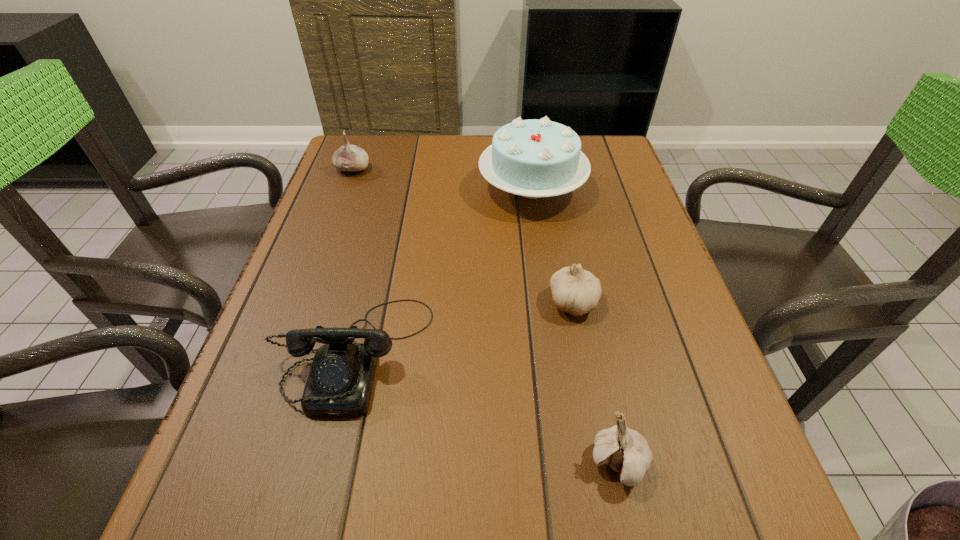
I want to click on birthday cake, so click(x=534, y=158).

At what (x,y) coordinates should I click in order to perform the action: click on the leftmost garlic. Please return your answer as a coordinate pair (x, y). The height and width of the screenshot is (540, 960). Looking at the image, I should click on (349, 157).

You are a GUI agent. You are given a task and a screenshot of the screen. Output one action in this format:
    pyautogui.click(x=<x>, y=<y>)
    Task: Click on the telephone
    This screenshot has height=540, width=960.
    Given the screenshot: What is the action you would take?
    pyautogui.click(x=340, y=381)

Image resolution: width=960 pixels, height=540 pixels. What are the coordinates of `the nearest garlic` in the screenshot? It's located at (626, 451).

The image size is (960, 540). Find the location of `the second farthest garlic`. the second farthest garlic is located at coordinates (576, 291).

This screenshot has width=960, height=540. Find the location of `free space located 0.210m on the front of the tallest object`. free space located 0.210m on the front of the tallest object is located at coordinates (545, 282).

Find the location of a particular element. The image size is (960, 540). free space located 0.190m on the front of the leftmost garlic is located at coordinates (334, 220).

Image resolution: width=960 pixels, height=540 pixels. I want to click on vacant space located on the front-facing side of the telephone, so click(316, 515).

Where is `free region located 0.140m on the back of the nearest object`? The height and width of the screenshot is (540, 960). free region located 0.140m on the back of the nearest object is located at coordinates (596, 362).

The width and height of the screenshot is (960, 540). In order to click on blank space located on the back of the second farthest garlic in this screenshot , I will do `click(566, 264)`.